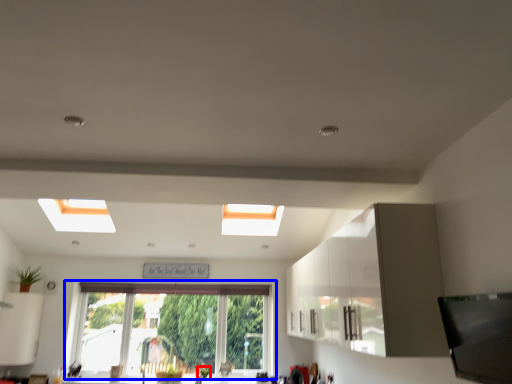
Question: Which object appears farthest to the camera in this image, plant (highlighted by a red box) or window (highlighted by a blue box)?

Choices:
 (A) plant
 (B) window

Answer: (B)